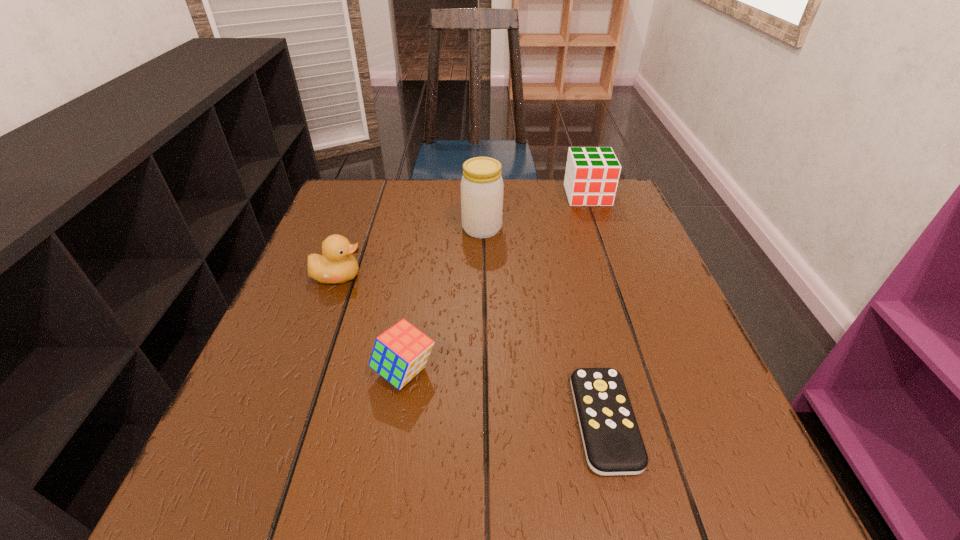
Locate an element on the screen. This screenshot has height=540, width=960. jar is located at coordinates (482, 187).

In order to click on the second farthest object in this screenshot , I will do `click(482, 187)`.

At what (x,y) coordinates should I click in order to perform the action: click on the taller cube. Please return your answer as a coordinate pair (x, y). The width and height of the screenshot is (960, 540). Looking at the image, I should click on (591, 179).

Find the location of a particular element. The height and width of the screenshot is (540, 960). the right cube is located at coordinates (591, 179).

This screenshot has height=540, width=960. What are the coordinates of `the third nearest object` in the screenshot? It's located at (337, 264).

The image size is (960, 540). Identify the location of duckling. (337, 264).

The height and width of the screenshot is (540, 960). Find the location of `the left cube`. the left cube is located at coordinates (400, 353).

The height and width of the screenshot is (540, 960). I want to click on the nearer cube, so click(400, 353).

In order to click on the shortest object in this screenshot , I will do `click(613, 445)`.

I want to click on free space located 0.100m on the left of the third object from right to left, so click(x=421, y=228).